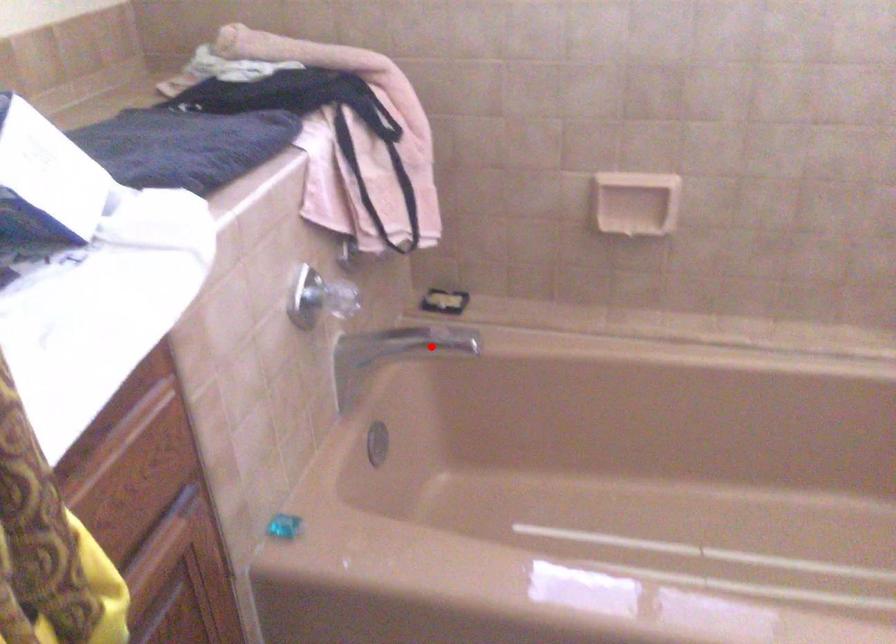
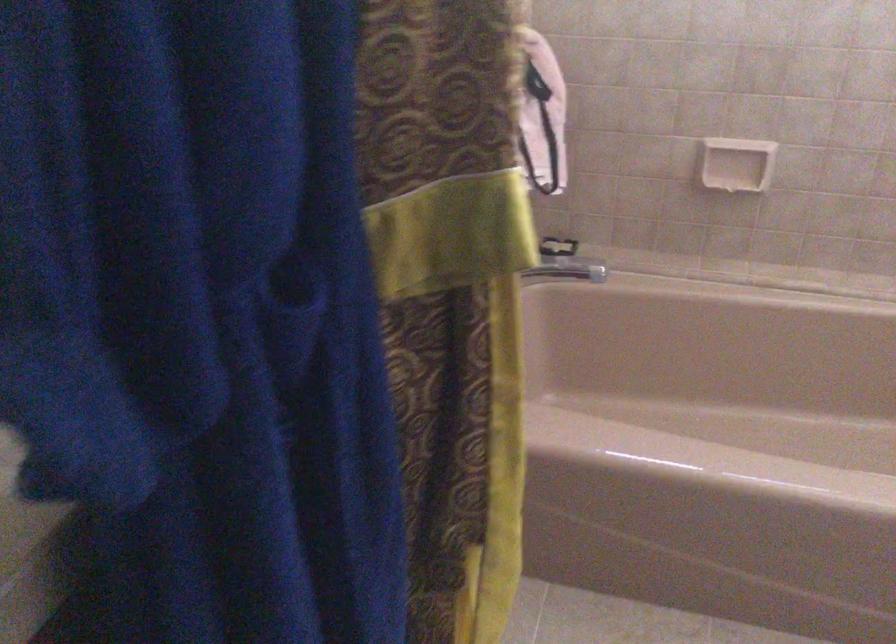
Where in the second image is the point corresponding to the highlighted location from the first image?

(569, 269)